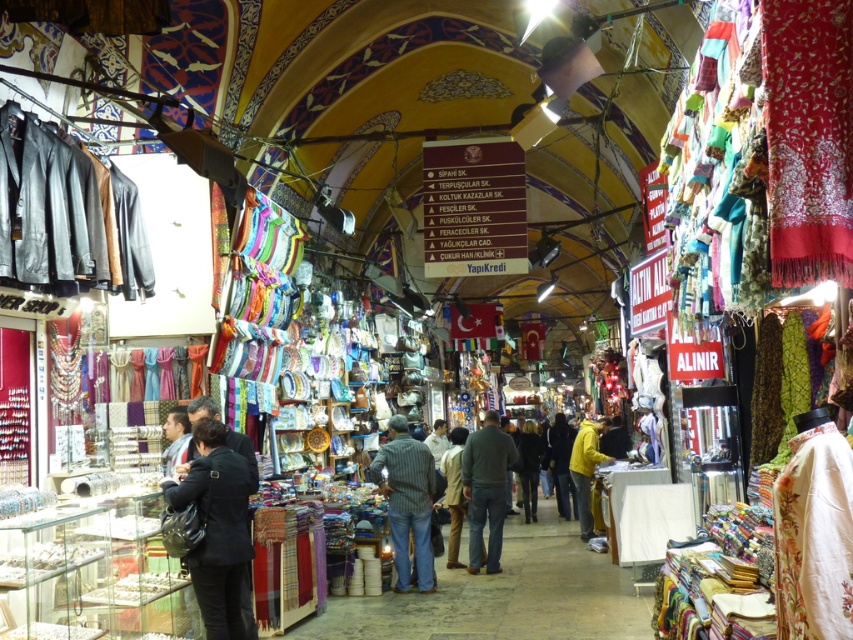
Question: Does dark blue fabric at center have a greater width compared to yellow fabric at center?

Choices:
 (A) no
 (B) yes

Answer: (B)

Question: Which of the following is the farthest from the observer?

Choices:
 (A) (374, 464)
 (B) (471, 547)
 (C) (532, 456)

Answer: (C)

Question: Does dark blue fabric at center have a lesser width compared to striped fabric at center?

Choices:
 (A) yes
 (B) no

Answer: (A)

Question: Which point is farther from the camera taking this photo?

Choices:
 (A) (457, 522)
 (B) (566, 516)

Answer: (B)

Question: Is dark gray sweater at center thinner than yellow jacket at center?

Choices:
 (A) no
 (B) yes

Answer: (A)

Question: Which of the following is the farthest from the observer?

Choices:
 (A) dark blue fabric at center
 (B) dark brown leather jacket at center
 (C) yellow fabric at center

Answer: (C)